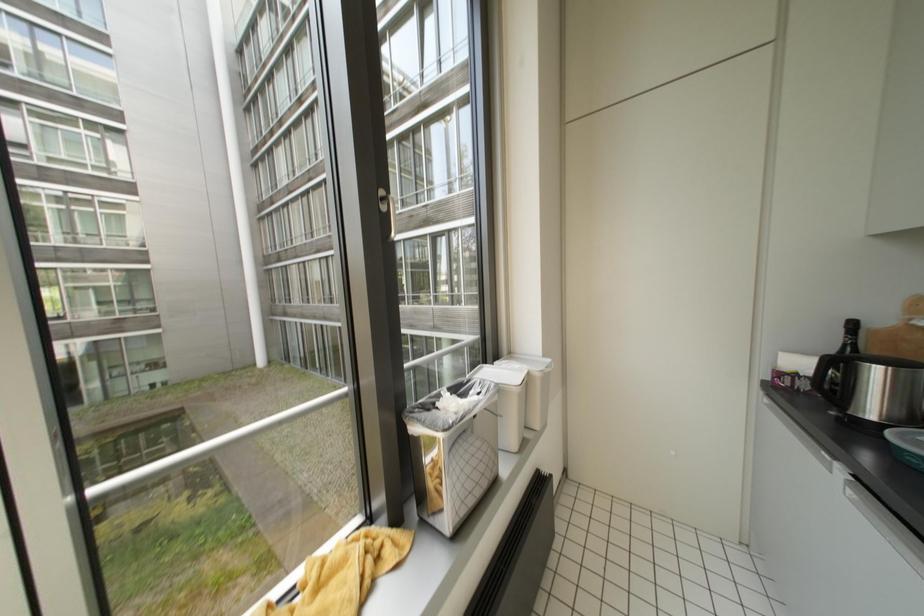
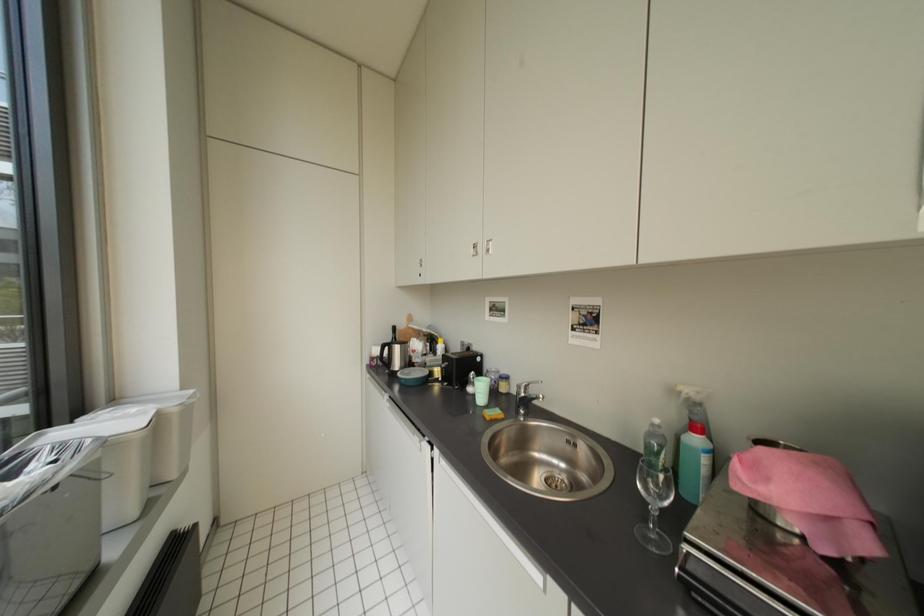
Question: The first image is from the beginning of the video and the second image is from the end. How did the camera likely rotate when shooting the video?

Choices:
 (A) Left
 (B) Right
 (C) Up
 (D) Down

Answer: (B)